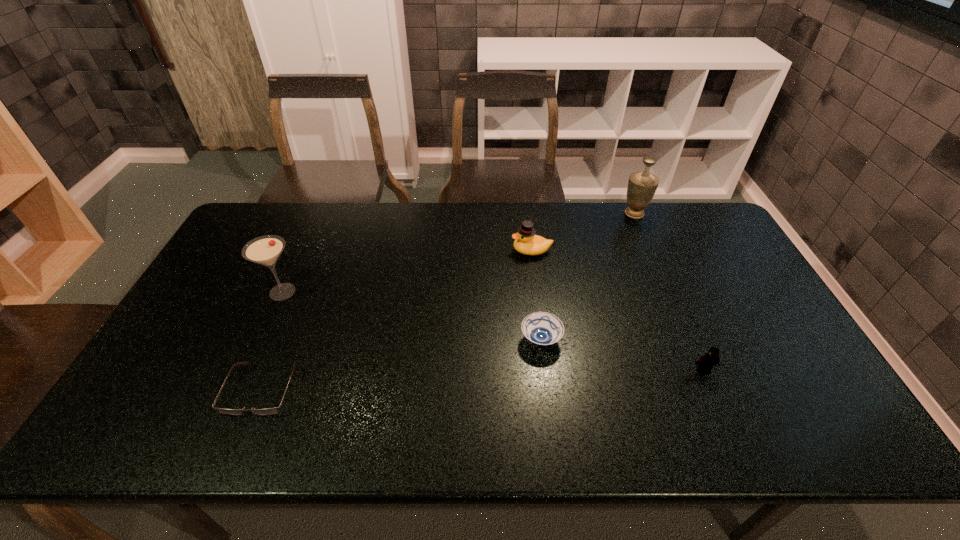
I want to click on object that is at the near edge, so point(268,411).

In the image, there is a desktop. Identify the location of vacant space at the far edge. (371, 203).

Find the location of a particular element. The height and width of the screenshot is (540, 960). vacant region at the near edge of the desktop is located at coordinates (648, 435).

At what (x,y) coordinates should I click in order to perform the action: click on vacant space at the right edge of the desktop. Please return your answer as a coordinate pair (x, y). Looking at the image, I should click on (728, 313).

I want to click on vacant space at the far left corner of the desktop, so click(269, 201).

Identify the location of vacant space at the near left corner of the desktop. Image resolution: width=960 pixels, height=540 pixels. (132, 413).

The height and width of the screenshot is (540, 960). Find the location of `vacant region between the farthest object and the third nearest object`. vacant region between the farthest object and the third nearest object is located at coordinates (588, 277).

This screenshot has width=960, height=540. Identify the location of free space between the fourth tallest object and the tallest object. (669, 292).

At what (x,y) coordinates should I click in order to perform the action: click on vacant point located between the second farthest object and the spectacles. Please return your answer as a coordinate pair (x, y). Image resolution: width=960 pixels, height=540 pixels. Looking at the image, I should click on (396, 320).

This screenshot has height=540, width=960. I want to click on free spot between the fourth nearest object and the second shortest object, so click(x=412, y=316).